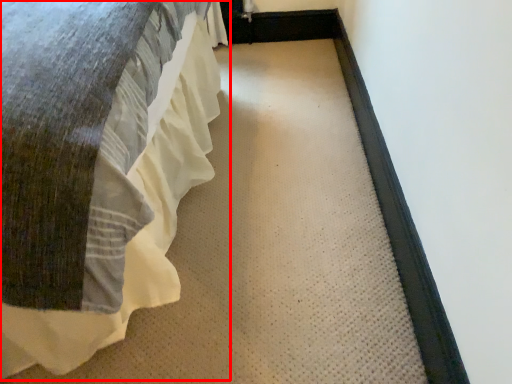
Question: In this image, where is bed (annotated by the red box) located relative to doormat?

Choices:
 (A) right
 (B) left

Answer: (B)